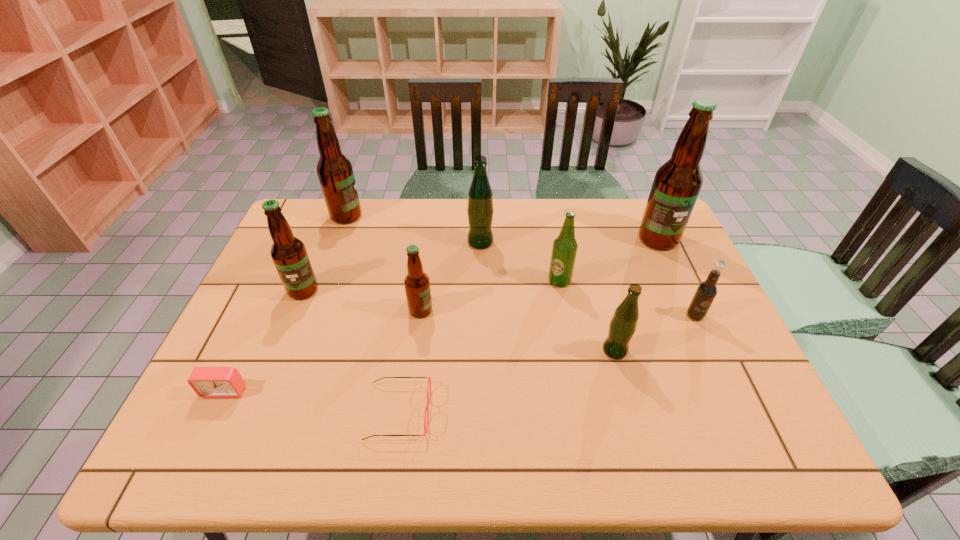
Select which object appears as the fourth closest to the second nearest beer bottle. Please provide its 2D coordinates. Your answer should be formatted as a tuple, i.e. [(x, y)], where the tuple contains the x and y coordinates of a point satisfying the conditions above.

[(564, 250)]

Find the location of a particular element. The width and height of the screenshot is (960, 540). the second closest object to the farthest green beer bottle is located at coordinates (417, 284).

Find the location of `beer bottle object that ranks as the sixth closest to the sixth farthest beer bottle`. beer bottle object that ranks as the sixth closest to the sixth farthest beer bottle is located at coordinates (677, 183).

Select which beer bottle appears as the fifth closest to the root beer. Please provide its 2D coordinates. Your answer should be formatted as a tuple, i.e. [(x, y)], where the tuple contains the x and y coordinates of a point satisfying the conditions above.

[(417, 284)]

Locate an element on the screen. The height and width of the screenshot is (540, 960). brown beer bottle object that ranks as the closest to the farthest brown beer bottle is located at coordinates (289, 255).

Where is `the fourth closest brown beer bottle to the second green beer bottle from left to right`? the fourth closest brown beer bottle to the second green beer bottle from left to right is located at coordinates (289, 255).

Select which green beer bottle is the closest to the second beer bottle from right to left. Please provide its 2D coordinates. Your answer should be formatted as a tuple, i.e. [(x, y)], where the tuple contains the x and y coordinates of a point satisfying the conditions above.

[(564, 250)]

Choose which green beer bottle is the second nearest neighbor to the second green beer bottle from left to right. Please provide its 2D coordinates. Your answer should be formatted as a tuple, i.e. [(x, y)], where the tuple contains the x and y coordinates of a point satisfying the conditions above.

[(622, 327)]

The width and height of the screenshot is (960, 540). I want to click on vacant space that satisfies the following two spatial constraints: 1. on the label of the second nearest beer bottle; 2. on the front-facing side of the red alarm clock, so click(410, 390).

You are a GUI agent. You are given a task and a screenshot of the screen. Output one action in this format:
    pyautogui.click(x=<x>, y=<y>)
    Task: Click on the vacant space that satisfies the following two spatial constraints: 1. on the label of the farthest beer bottle; 2. on the label of the second smallest brown beer bottle
    The width and height of the screenshot is (960, 540).
    Given the screenshot: What is the action you would take?
    pyautogui.click(x=319, y=291)